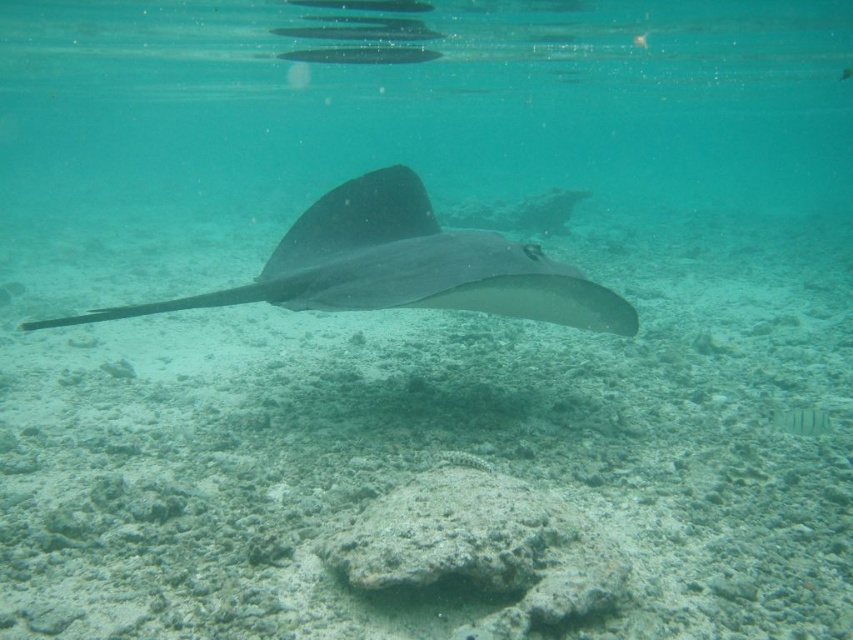
Does smooth gray stingray at center have a greater width compared to greenish-blue glossy fish at center?

Yes.

This screenshot has height=640, width=853. Identify the location of smooth gray stingray at center. (401, 266).

In order to click on smooth gray stingray at center in this screenshot , I will do `click(401, 266)`.